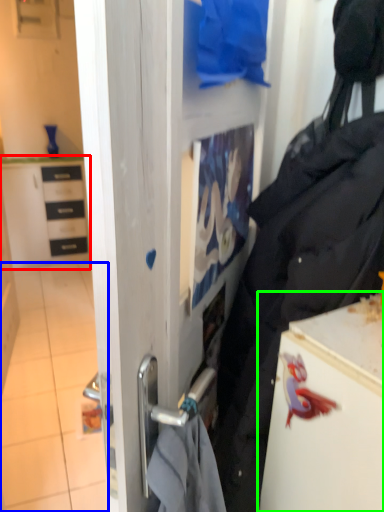
Question: Based on their relative distances, which object is farther from cabinetry (highlighted by a red box)? Choose from tile (highlighted by a blue box) and fridge (highlighted by a green box).

Choices:
 (A) tile
 (B) fridge

Answer: (B)